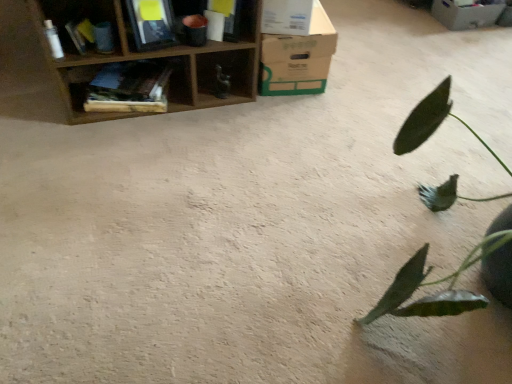
Question: From a real-world perspective, is wooden bookshelf at upper left, the second shelf when ordered from right to left, over green matte leafy plant at right?

Choices:
 (A) no
 (B) yes

Answer: (A)

Question: Is the position of wooden bookshelf at upper left, which is the second shelf in left-to-right order, less distant than that of green matte leafy plant at right?

Choices:
 (A) yes
 (B) no

Answer: (B)

Question: Can you confirm if wooden bookshelf at upper left, the second shelf when ordered from right to left, is positioned to the right of green matte leafy plant at right?

Choices:
 (A) no
 (B) yes

Answer: (A)

Question: From a real-world perspective, is wooden bookshelf at upper left, which is the second shelf in left-to-right order, below green matte leafy plant at right?

Choices:
 (A) no
 (B) yes

Answer: (B)

Question: Is wooden bookshelf at upper left, the second shelf when ordered from right to left, oriented towards green matte leafy plant at right?

Choices:
 (A) yes
 (B) no

Answer: (B)

Question: From the image's perspective, is wooden bookshelf at upper left, which is the second shelf in left-to-right order, on top of green matte leafy plant at right?

Choices:
 (A) no
 (B) yes

Answer: (B)

Question: Is brown cardboard box at upper center, the second cardboard box viewed from the top, smaller than green matte leafy plant at right?

Choices:
 (A) no
 (B) yes

Answer: (B)

Question: From a real-world perspective, is brown cardboard box at upper center, the 1th cardboard box ordered from the bottom, beneath green matte leafy plant at right?

Choices:
 (A) yes
 (B) no

Answer: (A)

Question: Is brown cardboard box at upper center, the second cardboard box viewed from the top, at the right side of green matte leafy plant at right?

Choices:
 (A) yes
 (B) no

Answer: (B)

Question: Considering the relative sizes of brown cardboard box at upper center, which appears as the first cardboard box when viewed from the front, and green matte leafy plant at right in the image provided, is brown cardboard box at upper center, which appears as the first cardboard box when viewed from the front, taller than green matte leafy plant at right?

Choices:
 (A) no
 (B) yes

Answer: (A)

Question: Is brown cardboard box at upper center, which is the 2th cardboard box from back to front, outside of green matte leafy plant at right?

Choices:
 (A) no
 (B) yes

Answer: (B)

Question: Is brown cardboard box at upper center, the second cardboard box viewed from the top, facing towards green matte leafy plant at right?

Choices:
 (A) no
 (B) yes

Answer: (A)

Question: From the image's perspective, is wooden bookshelf at upper left, which is the second shelf in left-to-right order, under wooden bookshelf at upper left, the 3th shelf when ordered from right to left?

Choices:
 (A) no
 (B) yes

Answer: (B)